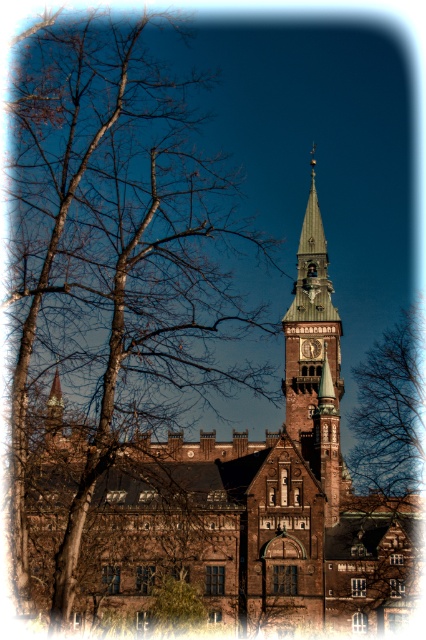
Consider the image. Can you confirm if brown textured tree at left is thinner than green wooden clock tower at upper center?

In fact, brown textured tree at left might be wider than green wooden clock tower at upper center.

Which is behind, point (195, 227) or point (287, 408)?

The point (195, 227) is behind.

What do you see at coordinates (114, 257) in the screenshot? I see `brown textured tree at left` at bounding box center [114, 257].

Find the location of a particular element. brown textured tree at left is located at coordinates (114, 257).

Is point (400, 486) in front of point (298, 432)?

That is False.

Who is higher up, bare branches at center or green wooden clock tower at upper center?

green wooden clock tower at upper center is above.

This screenshot has width=426, height=640. I want to click on bare branches at center, so click(391, 410).

Can you confirm if brown textured tree at left is positioned below bare branches at center?

No, brown textured tree at left is not below bare branches at center.

Is the position of brown textured tree at left more distant than that of bare branches at center?

No.

You are a GUI agent. You are given a task and a screenshot of the screen. Output one action in this format:
    pyautogui.click(x=<x>, y=<y>)
    Task: Click on the brown textured tree at left
    This screenshot has height=640, width=426.
    Given the screenshot: What is the action you would take?
    pyautogui.click(x=114, y=257)